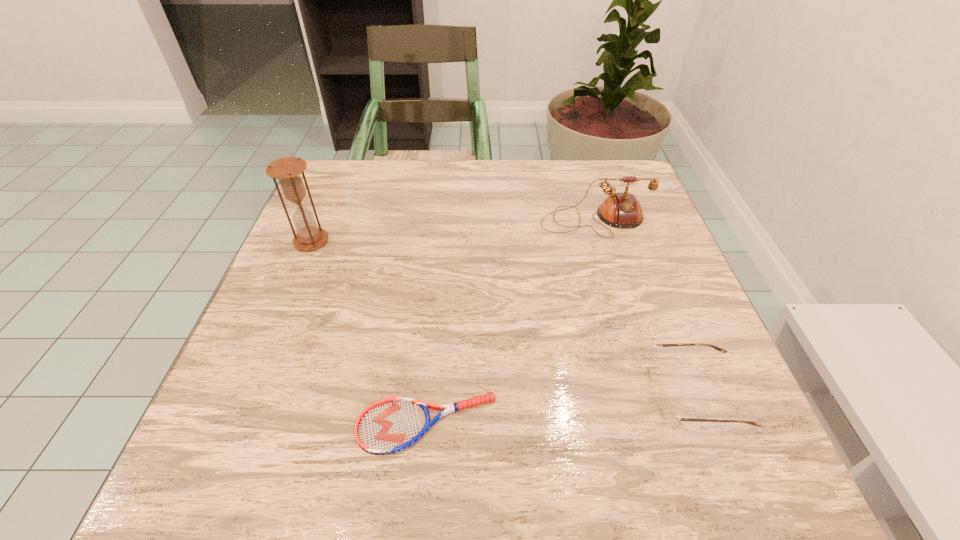
The image size is (960, 540). I want to click on vacant space at the left edge of the desktop, so click(x=332, y=235).

Where is `vacant space at the right edge`? This screenshot has width=960, height=540. vacant space at the right edge is located at coordinates click(654, 313).

In order to click on vacant space at the far left corner of the desktop in this screenshot , I will do `click(334, 170)`.

You are a GUI agent. You are given a task and a screenshot of the screen. Output one action in this format:
    pyautogui.click(x=<x>, y=<y>)
    Task: Click on the vacant space at the far right corner
    This screenshot has height=540, width=960.
    Given the screenshot: What is the action you would take?
    pyautogui.click(x=581, y=162)

I want to click on vacant area between the spectacles and the tallest object, so click(x=503, y=317).

Identify the location of free spot between the leftmost object and the second tallest object. The width and height of the screenshot is (960, 540). (453, 231).

Where is `vacant space that is in between the tallest object and the spectacles`? vacant space that is in between the tallest object and the spectacles is located at coordinates pos(503,317).

The height and width of the screenshot is (540, 960). I want to click on free space between the third shortest object and the shortest object, so click(511, 322).

This screenshot has width=960, height=540. I want to click on empty space that is in between the shortest object and the third tallest object, so click(x=561, y=408).

Identify the location of free space between the tallest object and the third shortest object. (453, 231).